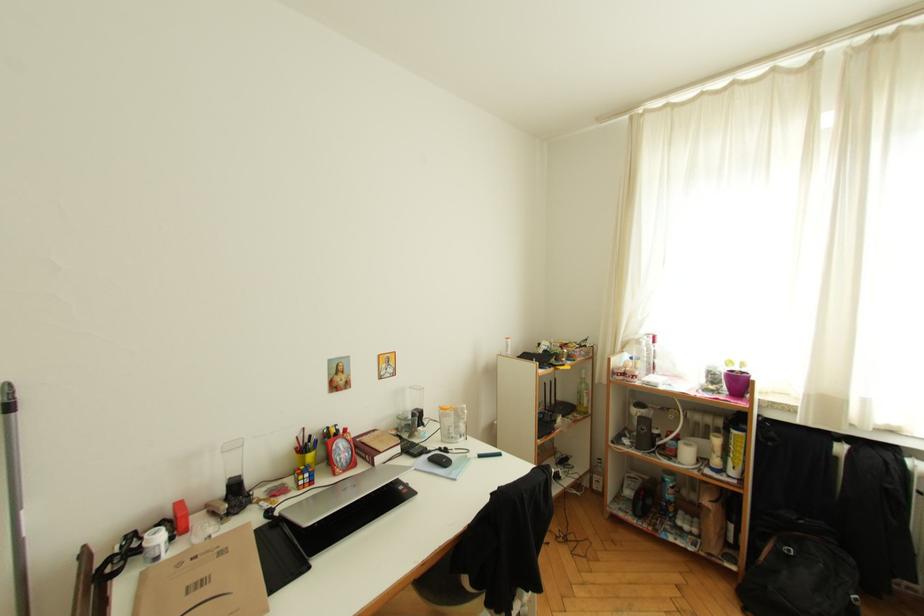
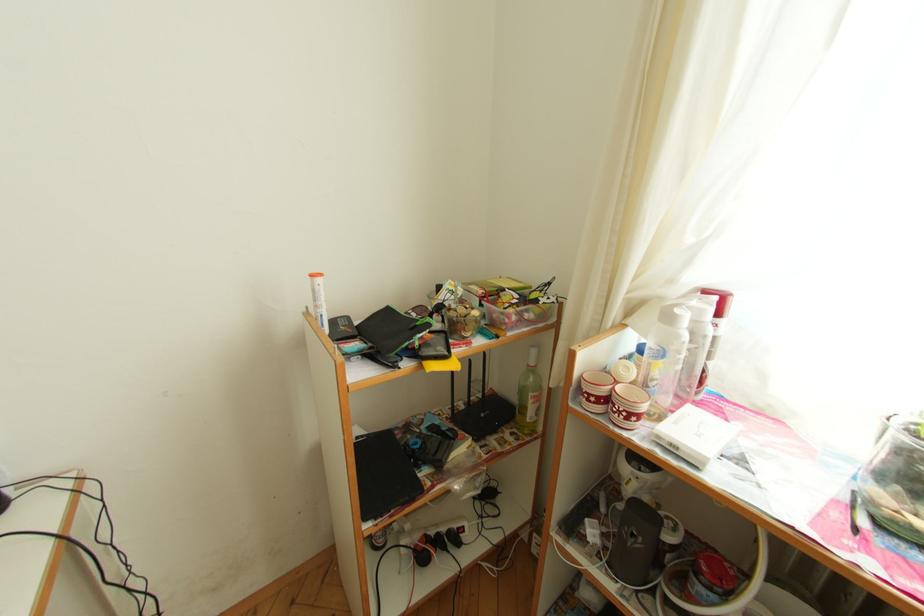
The images are taken continuously from a first-person perspective. In which direction are you moving?

The movement direction of the cameraman is right, forward.